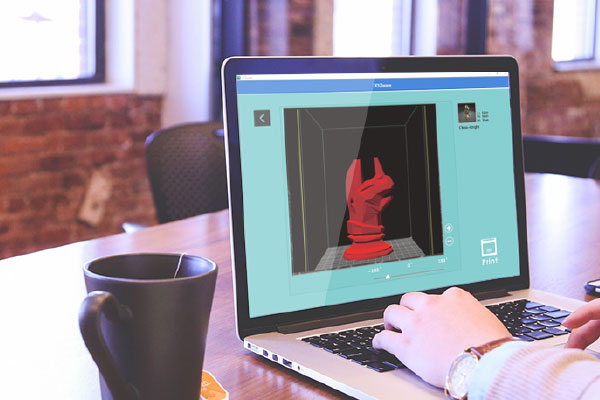
Where is `laptop`? This screenshot has height=400, width=600. laptop is located at coordinates (357, 374).